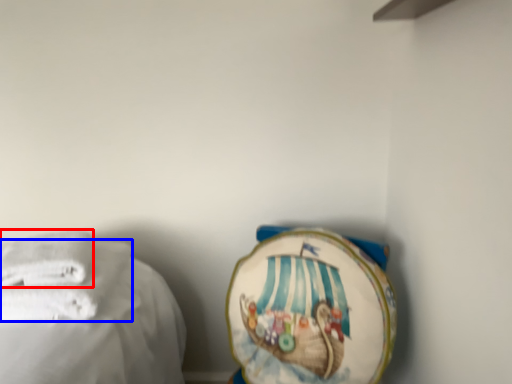
Question: Which object is further to the camera taking this photo, towel (highlighted by a red box) or towel (highlighted by a blue box)?

Choices:
 (A) towel
 (B) towel

Answer: (A)